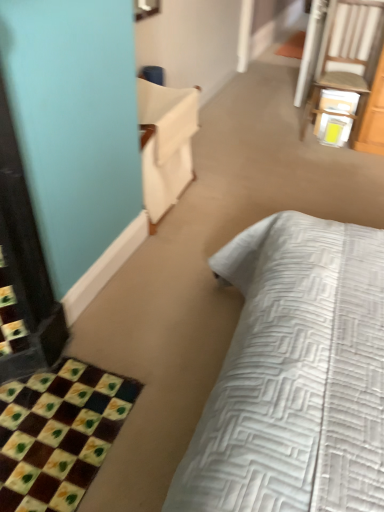
Question: In the image, is checkerboard fabric bath mat at lower left on the left side or the right side of white wood chair at upper right?

Choices:
 (A) right
 (B) left

Answer: (B)

Question: From the image's perspective, is checkerboard fabric bath mat at lower left above or below white wood chair at upper right?

Choices:
 (A) below
 (B) above

Answer: (A)

Question: Which object is the farthest from the checkerboard fabric bath mat at lower left?

Choices:
 (A) white wood chair at upper right
 (B) white fabric armchair at upper left

Answer: (A)

Question: Which object is the closest to the checkerboard fabric bath mat at lower left?

Choices:
 (A) white fabric armchair at upper left
 (B) white wood chair at upper right

Answer: (A)